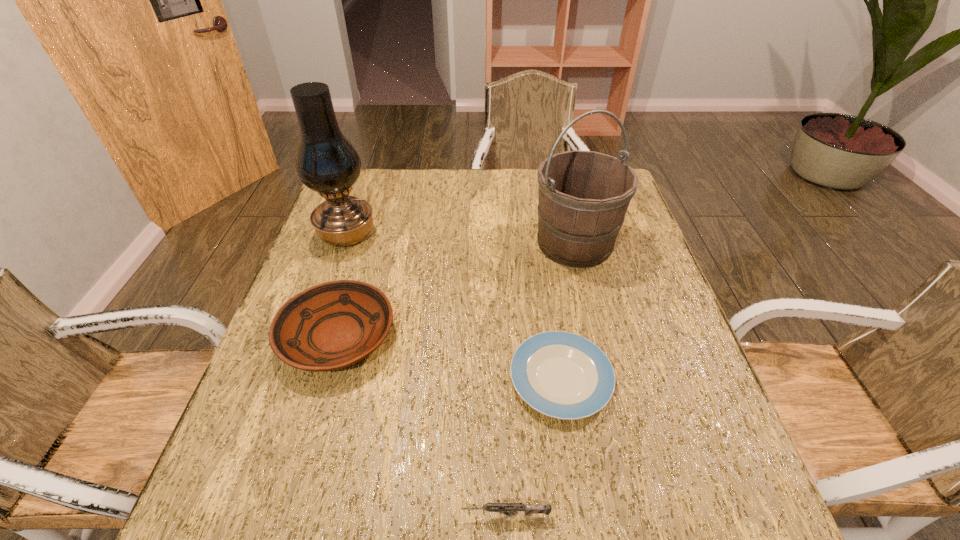
The width and height of the screenshot is (960, 540). Identify the location of object that ranks as the second closest to the third shortest object. (563, 375).

In order to click on the closest object to the shorter plate in this screenshot , I will do `click(511, 509)`.